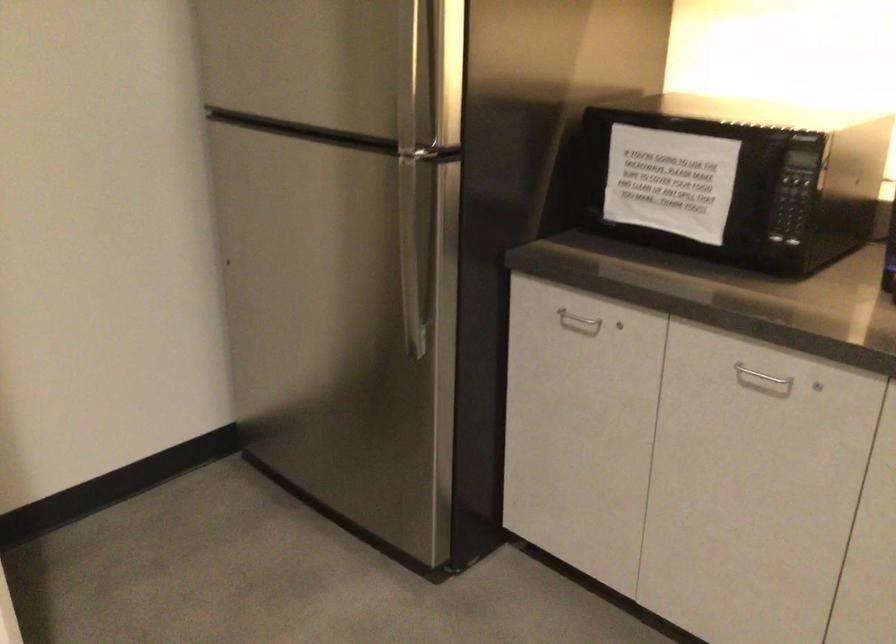
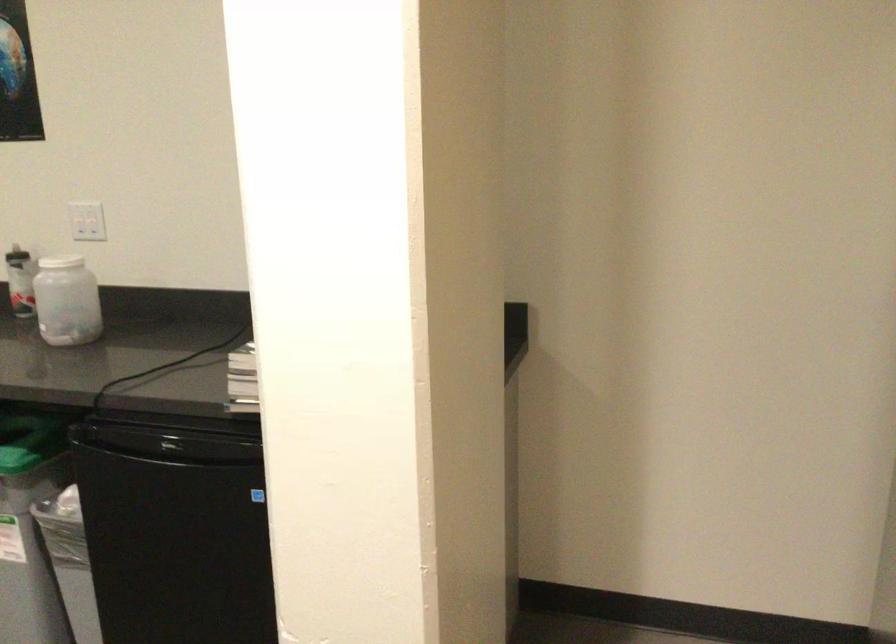
Question: Based on the continuous images, in which direction is the camera rotating? Reply with the corresponding letter.

Choices:
 (A) Left
 (B) Right
 (C) Up
 (D) Down

Answer: (A)